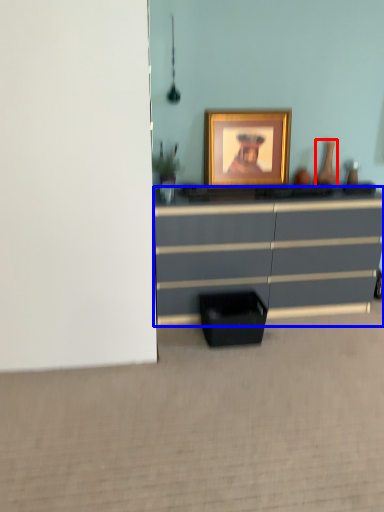
Question: Which of the following is the closest to the observer, vase (highlighted by a red box) or chest of drawers (highlighted by a blue box)?

Choices:
 (A) vase
 (B) chest of drawers

Answer: (B)